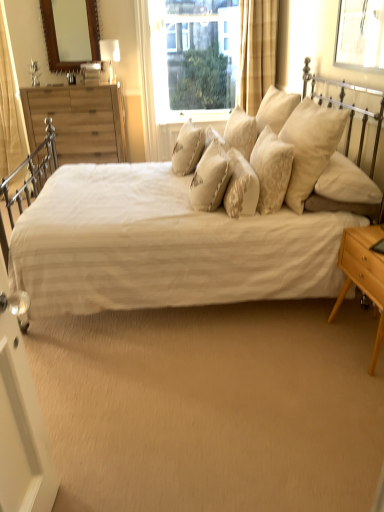
You are a GUI agent. You are given a task and a screenshot of the screen. Output one action in this format:
    pyautogui.click(x=<x>, y=<y>)
    Task: Click on the creamy fabric pillow at center, which is the 5th pillow from left to right
    This screenshot has height=512, width=384.
    Given the screenshot: What is the action you would take?
    pyautogui.click(x=271, y=170)

What is the approximate width of wooden chest of drawers at left?

The width of wooden chest of drawers at left is 19.99 inches.

Measure the distance between point (28, 442) and camera.

Point (28, 442) and camera are 1.36 meters apart from each other.

This screenshot has height=512, width=384. I want to click on soft cream fabric pillows at center, positioned as the first pillow in right-to-left order, so click(x=310, y=146).

The height and width of the screenshot is (512, 384). Identify the location of creamy fabric pillow at center, which is the 5th pillow from left to right. (271, 170).

Is beige textured pillow at center, the second pillow viewed from the left, not inside transparent plastic window screen at upper right?

Yes, beige textured pillow at center, the second pillow viewed from the left, is located beyond the bounds of transparent plastic window screen at upper right.

Considering the sizes of objects beige textured pillow at center, the fifth pillow from the right, and transparent plastic window screen at upper right in the image provided, who is smaller, beige textured pillow at center, the fifth pillow from the right, or transparent plastic window screen at upper right?

transparent plastic window screen at upper right.

Which of these two, beige textured pillow at center, the fifth pillow from the right, or transparent plastic window screen at upper right, is wider?

beige textured pillow at center, the fifth pillow from the right.

From the image's perspective, is textured cream pillow at center, arranged as the 1th pillow when viewed from the left, located beneath creamy fabric pillow at center, which ranks as the second pillow in right-to-left order?

No, from the image's perspective, textured cream pillow at center, arranged as the 1th pillow when viewed from the left, is not below creamy fabric pillow at center, which ranks as the second pillow in right-to-left order.

From a real-world perspective, which is physically below, textured cream pillow at center, the sixth pillow in the right-to-left sequence, or creamy fabric pillow at center, which ranks as the second pillow in right-to-left order?

textured cream pillow at center, the sixth pillow in the right-to-left sequence, is physically lower.

Between wooden chest of drawers at left and soft cream fabric pillows at center, the 6th pillow from the left, which one has more height?

wooden chest of drawers at left.

Who is bigger, wooden chest of drawers at left or soft cream fabric pillows at center, the 6th pillow from the left?

With larger size is wooden chest of drawers at left.

Is wooden chest of drawers at left wider than soft cream fabric pillows at center, positioned as the first pillow in right-to-left order?

Correct, the width of wooden chest of drawers at left exceeds that of soft cream fabric pillows at center, positioned as the first pillow in right-to-left order.

How much distance is there between wooden chest of drawers at left and soft cream fabric pillows at center, positioned as the first pillow in right-to-left order?

wooden chest of drawers at left and soft cream fabric pillows at center, positioned as the first pillow in right-to-left order, are 2.18 meters apart.

Is white glossy screen door at lower left aimed at light wood/texture nightstand at lower right?

No, white glossy screen door at lower left is not oriented towards light wood/texture nightstand at lower right.

Which object is wider, white glossy screen door at lower left or light wood/texture nightstand at lower right?

light wood/texture nightstand at lower right.

The height and width of the screenshot is (512, 384). I want to click on screen door in front of the light wood/texture nightstand at lower right, so click(x=21, y=431).

From a real-world perspective, who is located higher, beige textured pillow at center, acting as the 4th pillow starting from the right, or textured cream pillow at center, the sixth pillow in the right-to-left sequence?

textured cream pillow at center, the sixth pillow in the right-to-left sequence, is physically above.

Is beige textured pillow at center, which ranks as the third pillow in left-to-right order, situated inside textured cream pillow at center, the sixth pillow in the right-to-left sequence, or outside?

beige textured pillow at center, which ranks as the third pillow in left-to-right order, cannot be found inside textured cream pillow at center, the sixth pillow in the right-to-left sequence.

From the image's perspective, is beige textured pillow at center, which ranks as the third pillow in left-to-right order, on top of textured cream pillow at center, the sixth pillow in the right-to-left sequence?

No.

Which point is more distant from viewer, (223, 204) or (184, 145)?

The point (184, 145) is farther.

Is wooden chest of drawers at left completely or partially inside beige textured pillow at center, which ranks as the third pillow in left-to-right order?

Actually, wooden chest of drawers at left is outside beige textured pillow at center, which ranks as the third pillow in left-to-right order.

Which is nearer, (247, 195) or (104, 102)?

Point (247, 195)

Considering the relative sizes of beige textured pillow at center, acting as the 4th pillow starting from the right, and wooden chest of drawers at left in the image provided, is beige textured pillow at center, acting as the 4th pillow starting from the right, wider than wooden chest of drawers at left?

In fact, beige textured pillow at center, acting as the 4th pillow starting from the right, might be narrower than wooden chest of drawers at left.

Considering the sizes of objects clear glass window at upper center and transparent plastic window screen at upper right in the image provided, who is smaller, clear glass window at upper center or transparent plastic window screen at upper right?

transparent plastic window screen at upper right.

Are clear glass window at upper center and transparent plastic window screen at upper right making contact?

No, clear glass window at upper center is not making contact with transparent plastic window screen at upper right.

How distant is clear glass window at upper center from transparent plastic window screen at upper right?

clear glass window at upper center and transparent plastic window screen at upper right are 9.83 feet apart.

This screenshot has height=512, width=384. What are the coordinates of `window screen above the clear glass window at upper center (from a real-world perspective)` in the screenshot? It's located at (360, 34).

At what (x,y) coordinates should I click in order to perform the action: click on window screen located in front of the beige textured pillow at center, the second pillow viewed from the left. Please return your answer as a coordinate pair (x, y). The width and height of the screenshot is (384, 512). Looking at the image, I should click on (360, 34).

The height and width of the screenshot is (512, 384). What are the coordinates of `the 3rd pillow behind when counting from the creamy fabric pillow at center, which ranks as the second pillow in right-to-left order` in the screenshot? It's located at (188, 148).

Considering their positions, is white textured bed at center positioned further to textured cream pillow at center, the sixth pillow in the right-to-left sequence, than clear glass window at upper center?

The object further to textured cream pillow at center, the sixth pillow in the right-to-left sequence, is clear glass window at upper center.

Considering their positions, is beige textured pillow at center, acting as the 4th pillow starting from the right, positioned closer to light wood/texture nightstand at lower right than creamy fabric pillow at center, which is the 5th pillow from left to right?

creamy fabric pillow at center, which is the 5th pillow from left to right.

Estimate the real-world distances between objects in this image. Which object is further from transparent plastic window screen at upper right, soft cream fabric pillows at center, positioned as the first pillow in right-to-left order, or wooden chest of drawers at left?

The object further to transparent plastic window screen at upper right is wooden chest of drawers at left.

When comparing their distances from beige textured pillow at center, acting as the 4th pillow starting from the right, does light wood/texture nightstand at lower right or white textured bed at center seem closer?

white textured bed at center.

Estimate the real-world distances between objects in this image. Which object is closer to wooden chest of drawers at left, creamy fabric pillow at center, which ranks as the second pillow in right-to-left order, or beige textured pillow at center, the fifth pillow from the right?

beige textured pillow at center, the fifth pillow from the right, is positioned closer to the anchor wooden chest of drawers at left.

Consider the image. Based on their spatial positions, is beige textured pillow at center, which ranks as the third pillow in left-to-right order, or creamy fabric pillow at center, which ranks as the second pillow in right-to-left order, closer to soft cream fabric pillows at center, the 6th pillow from the left?

creamy fabric pillow at center, which ranks as the second pillow in right-to-left order, lies closer to soft cream fabric pillows at center, the 6th pillow from the left, than the other object.

When comparing their distances from white glossy screen door at lower left, does white textured bed at center or beige textured pillow at center, acting as the 4th pillow starting from the right, seem further?

beige textured pillow at center, acting as the 4th pillow starting from the right, is positioned further to the anchor white glossy screen door at lower left.

In the scene shown: When comparing their distances from textured cream pillow at center, arranged as the 1th pillow when viewed from the left, does soft cream fabric pillows at center, positioned as the first pillow in right-to-left order, or beige textured pillow at center, which ranks as the third pillow in left-to-right order, seem closer?

beige textured pillow at center, which ranks as the third pillow in left-to-right order.

The image size is (384, 512). What are the coordinates of `chest of drawers between creamy fabric pillow at center, which ranks as the second pillow in right-to-left order, and matte white table lamp at upper center from front to back` in the screenshot? It's located at (78, 122).

Find the location of a particular element. The height and width of the screenshot is (512, 384). chest of drawers between beige textured pillow at center, which ranks as the third pillow in left-to-right order, and matte white table lamp at upper center in the front-back direction is located at coordinates (78, 122).

Where is `nightstand between transparent plastic window screen at upper right and white glossy screen door at lower left vertically`? The height and width of the screenshot is (512, 384). nightstand between transparent plastic window screen at upper right and white glossy screen door at lower left vertically is located at coordinates (363, 273).

In order to click on chest of drawers between light wood/texture nightstand at lower right and matte white table lamp at upper center in the front-back direction in this screenshot , I will do `click(78, 122)`.